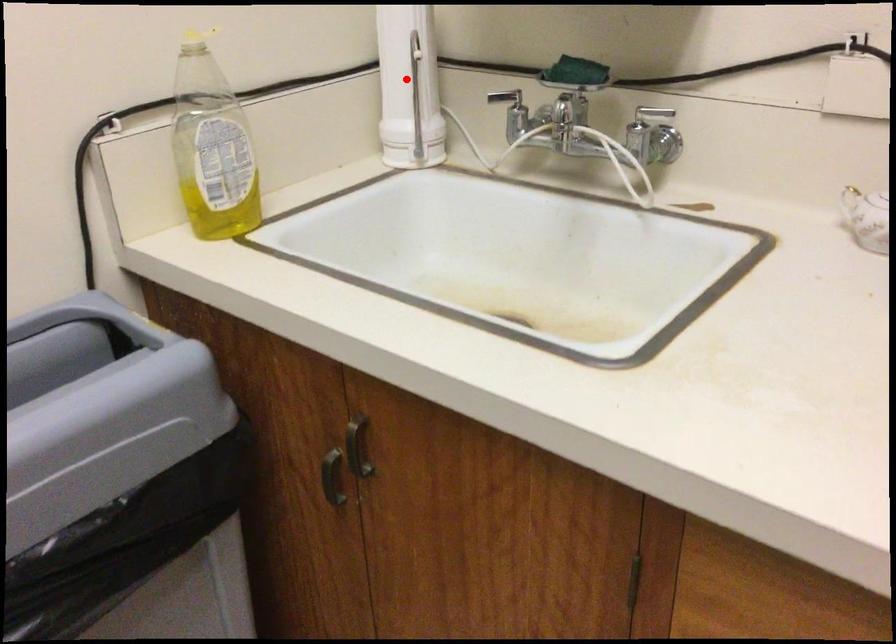
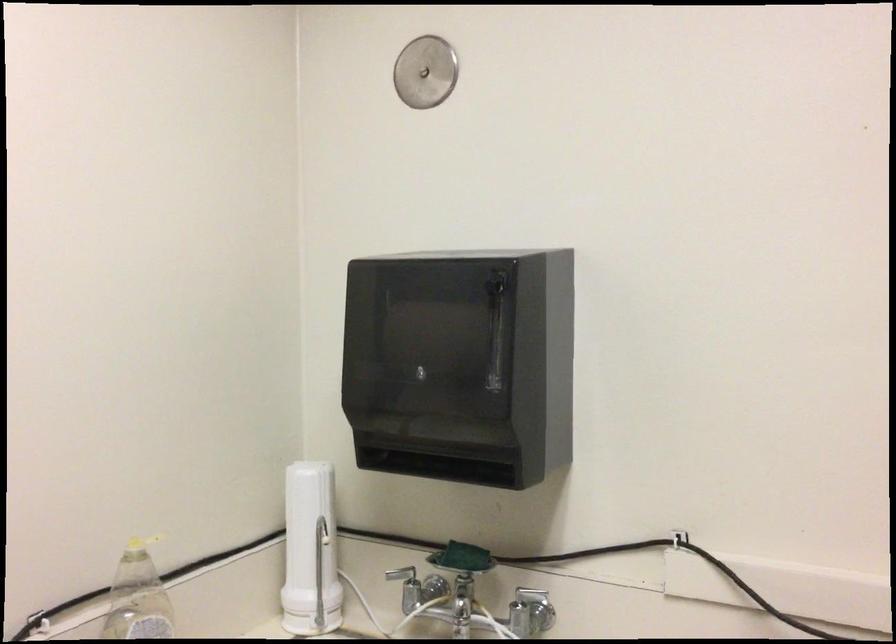
Where in the second image is the point corresponding to the highlighted location from the first image?

(309, 551)